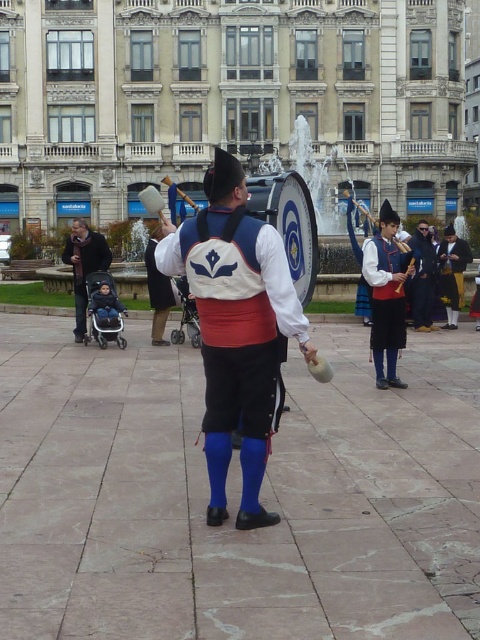
Question: Which point appears closest to the camera in this image?

Choices:
 (A) (373, 248)
 (B) (465, 259)

Answer: (A)

Question: Can you confirm if matte blue fabric drum at center is smaller than matte blue fabric hat at right?

Choices:
 (A) no
 (B) yes

Answer: (A)

Question: Estimate the real-world distances between objects in this image. Which object is closer to the velvet brown vest at center?

Choices:
 (A) dark blue fabric jacket at left
 (B) matte blue fabric hat at right
 (C) matte blue fabric drum at center

Answer: (B)

Question: Is matte blue fabric drum at center positioned before velvet brown vest at center?

Choices:
 (A) yes
 (B) no

Answer: (A)

Question: Considering the real-world distances, which object is farthest from the velvet brown vest at center?

Choices:
 (A) dark blue fabric jacket at left
 (B) matte blue fabric hat at right

Answer: (A)

Question: Is matte blue fabric drum at center below velvet brown vest at center?

Choices:
 (A) yes
 (B) no

Answer: (B)